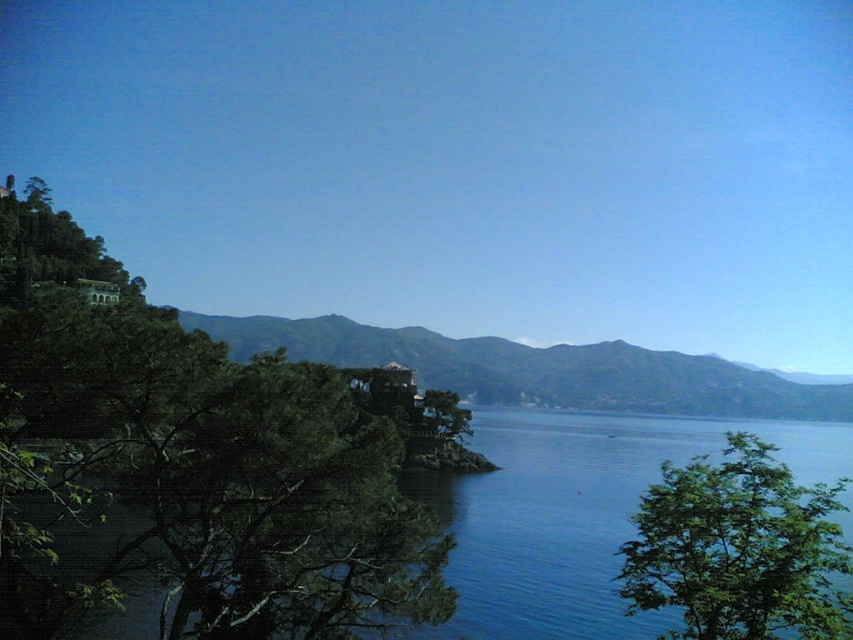
Is point (795, 512) less distant than point (726, 376)?

Yes, point (795, 512) is in front of point (726, 376).

Identify the location of green leafy tree at lower right. The height and width of the screenshot is (640, 853). (740, 548).

Identify the location of green leafy tree at lower right. (740, 548).

Is green leafy tree at left wider than green matte hillside at center?

Incorrect, green leafy tree at left's width does not surpass green matte hillside at center's.

Can you confirm if green leafy tree at left is bigger than green matte hillside at center?

No.

The image size is (853, 640). I want to click on green leafy tree at left, so click(x=187, y=465).

I want to click on green leafy tree at left, so click(187, 465).

From the picture: Which of these two, green leafy tree at left or green leafy tree at lower right, stands taller?

green leafy tree at left

Consider the image. Does green leafy tree at left appear on the right side of green leafy tree at lower right?

Incorrect, green leafy tree at left is not on the right side of green leafy tree at lower right.

This screenshot has width=853, height=640. Describe the element at coordinates (187, 465) in the screenshot. I see `green leafy tree at left` at that location.

Identify the location of green leafy tree at left. This screenshot has width=853, height=640. (187, 465).